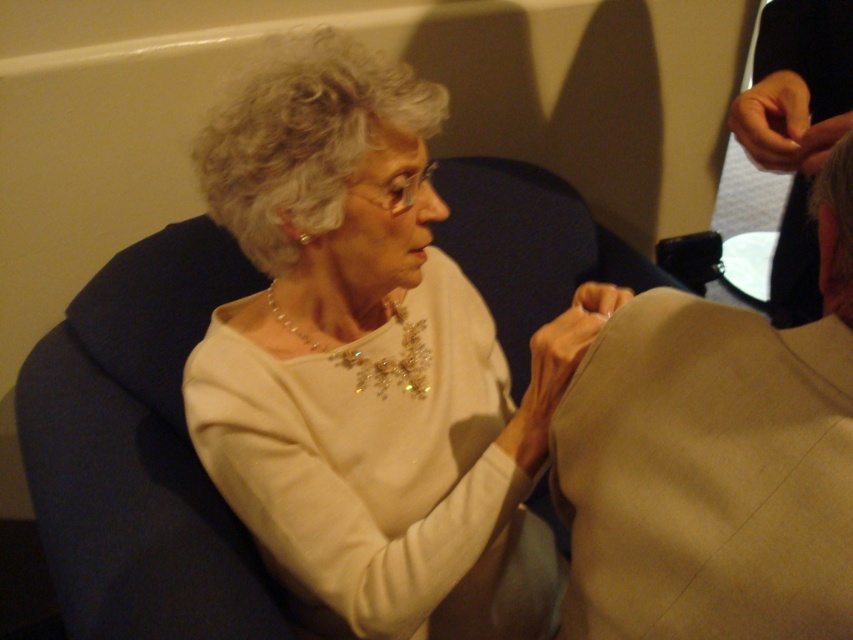
Question: Is white satin blouse at center to the right of matte beige fabric at upper right from the viewer's perspective?

Choices:
 (A) no
 (B) yes

Answer: (A)

Question: Which point is closer to the camera?

Choices:
 (A) (833, 234)
 (B) (828, 51)
 (C) (596, 285)

Answer: (A)

Question: Which point appears farthest from the camera in this image?

Choices:
 (A) (785, 220)
 (B) (440, 564)

Answer: (A)

Question: Does white satin blouse at center appear under matte beige fabric at upper right?

Choices:
 (A) no
 (B) yes

Answer: (B)

Question: Which point is farther to the camera?

Choices:
 (A) tan fabric sleeve at upper right
 (B) white satin blouse at center

Answer: (B)

Question: Is white satin blouse at center to the left of matte beige fabric at upper right from the viewer's perspective?

Choices:
 (A) no
 (B) yes

Answer: (B)